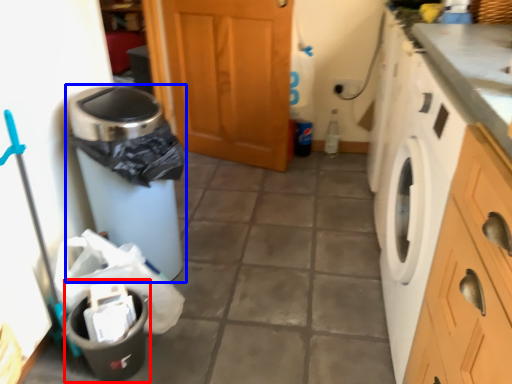
Question: Which of the following is the farthest to the observer, recycling bin (highlighted by a red box) or waste container (highlighted by a blue box)?

Choices:
 (A) recycling bin
 (B) waste container

Answer: (B)